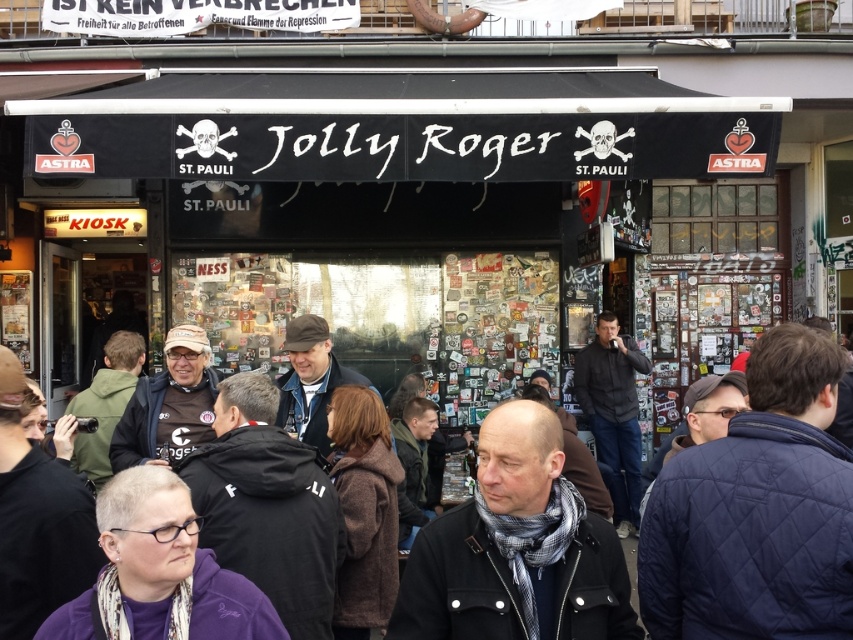
Question: Among these points, which one is farthest from the camera?

Choices:
 (A) (634, 365)
 (B) (595, 612)
 (C) (689, 557)

Answer: (A)

Question: Does dark brown leather jacket at center have a lesser width compared to dark gray jacket at center?

Choices:
 (A) yes
 (B) no

Answer: (B)

Question: Does dark gray wool scarf at center have a greater width compared to dark gray jacket at center?

Choices:
 (A) yes
 (B) no

Answer: (A)

Question: Which of the following is the farthest from the observer?

Choices:
 (A) dark brown leather jacket at center
 (B) dark gray jacket at center
 (C) dark gray wool scarf at center

Answer: (B)

Question: Does dark brown leather jacket at center appear on the right side of dark gray wool scarf at center?

Choices:
 (A) yes
 (B) no

Answer: (A)

Question: Considering the real-world distances, which object is farthest from the dark gray wool scarf at center?

Choices:
 (A) dark gray jacket at center
 (B) dark brown leather jacket at center

Answer: (A)